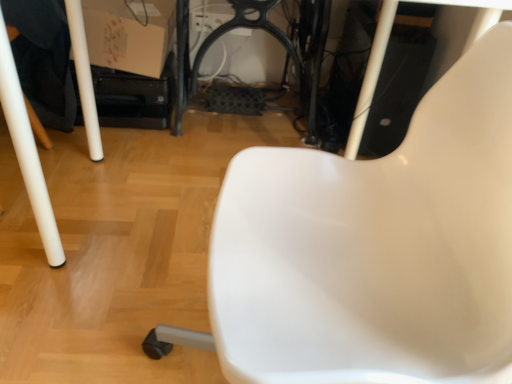
You are a GUI agent. You are given a task and a screenshot of the screen. Output one action in this format:
    pyautogui.click(x=<x>, y=<y>)
    Task: Click on the white plastic chair at center
    
    Given the screenshot: What is the action you would take?
    pyautogui.click(x=374, y=248)

The width and height of the screenshot is (512, 384). Describe the element at coordinates (374, 248) in the screenshot. I see `white plastic chair at center` at that location.

Where is `matte cardboard box at upper left`? Image resolution: width=512 pixels, height=384 pixels. matte cardboard box at upper left is located at coordinates (129, 34).

Describe the element at coordinates (129, 34) in the screenshot. The image size is (512, 384). I see `matte cardboard box at upper left` at that location.

Where is `white plastic chair at center`? This screenshot has height=384, width=512. white plastic chair at center is located at coordinates (374, 248).

Can you confirm if white plastic chair at center is positioned to the right of matte cardboard box at upper left?

Yes.

Does white plastic chair at center come in front of matte cardboard box at upper left?

Yes, white plastic chair at center is closer to the camera.

Is point (256, 320) positioned after point (150, 48)?

No, it is not.

From the image's perspective, which is below, white plastic chair at center or matte cardboard box at upper left?

white plastic chair at center, from the image's perspective.

From a real-world perspective, which object rests below the other?

matte cardboard box at upper left is physically lower.

Between white plastic chair at center and matte cardboard box at upper left, which one has larger width?

white plastic chair at center.

Considering the sizes of objects white plastic chair at center and matte cardboard box at upper left in the image provided, who is taller, white plastic chair at center or matte cardboard box at upper left?

white plastic chair at center is taller.

Is white plastic chair at center bigger than matte cardboard box at upper left?

Indeed, white plastic chair at center has a larger size compared to matte cardboard box at upper left.

Is white plastic chair at center not inside matte cardboard box at upper left?

white plastic chair at center is positioned outside matte cardboard box at upper left.

In the scene shown: Is there a large distance between white plastic chair at center and matte cardboard box at upper left?

Yes, white plastic chair at center and matte cardboard box at upper left are located far from each other.

Is white plastic chair at center turned away from matte cardboard box at upper left?

No, white plastic chair at center is not facing the opposite direction of matte cardboard box at upper left.

Can you tell me how much white plastic chair at center and matte cardboard box at upper left differ in facing direction?

They differ by 90 degrees in their facing directions.

Locate an element on the screen. The height and width of the screenshot is (384, 512). chair located below the matte cardboard box at upper left (from the image's perspective) is located at coordinates (374, 248).

Considering the positions of objects matte cardboard box at upper left and white plastic chair at center in the image provided, who is more to the left, matte cardboard box at upper left or white plastic chair at center?

matte cardboard box at upper left is more to the left.

Considering the positions of objects matte cardboard box at upper left and white plastic chair at center in the image provided, who is behind, matte cardboard box at upper left or white plastic chair at center?

Positioned behind is matte cardboard box at upper left.

Between point (88, 26) and point (418, 244), which one is positioned behind?

The point (88, 26) is more distant.

From the image's perspective, which is below, matte cardboard box at upper left or white plastic chair at center?

white plastic chair at center appears lower in the image.

From a real-world perspective, is matte cardboard box at upper left on white plastic chair at center?

No, from a real-world perspective, matte cardboard box at upper left is not above white plastic chair at center.

Considering the sizes of matte cardboard box at upper left and white plastic chair at center in the image, is matte cardboard box at upper left wider or thinner than white plastic chair at center?

Considering their sizes, matte cardboard box at upper left looks slimmer than white plastic chair at center.

Consider the image. Between matte cardboard box at upper left and white plastic chair at center, which one has more height?

white plastic chair at center is taller.

In the scene shown: Considering the sizes of objects matte cardboard box at upper left and white plastic chair at center in the image provided, who is smaller, matte cardboard box at upper left or white plastic chair at center?

Smaller between the two is matte cardboard box at upper left.

Is matte cardboard box at upper left not within white plastic chair at center?

Yes, matte cardboard box at upper left is located beyond the bounds of white plastic chair at center.

Can you see matte cardboard box at upper left touching white plastic chair at center?

No, matte cardboard box at upper left is not beside white plastic chair at center.

Is matte cardboard box at upper left oriented towards white plastic chair at center?

Yes, matte cardboard box at upper left is turned towards white plastic chair at center.

In order to click on chair above the matte cardboard box at upper left (from a real-world perspective) in this screenshot , I will do `click(374, 248)`.

Identify the location of chair positioned vertically above the matte cardboard box at upper left (from a real-world perspective). This screenshot has height=384, width=512. (374, 248).

This screenshot has width=512, height=384. What are the coordinates of `cardboard box that is on the left side of white plastic chair at center` in the screenshot? It's located at (129, 34).